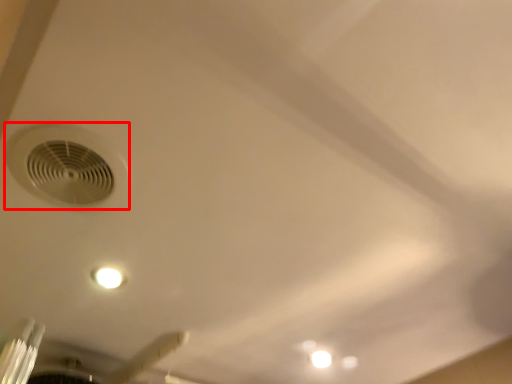
Question: From the image, what is the correct spatial relationship of air conditioning (annotated by the red box) in relation to ceiling fan?

Choices:
 (A) left
 (B) right

Answer: (B)